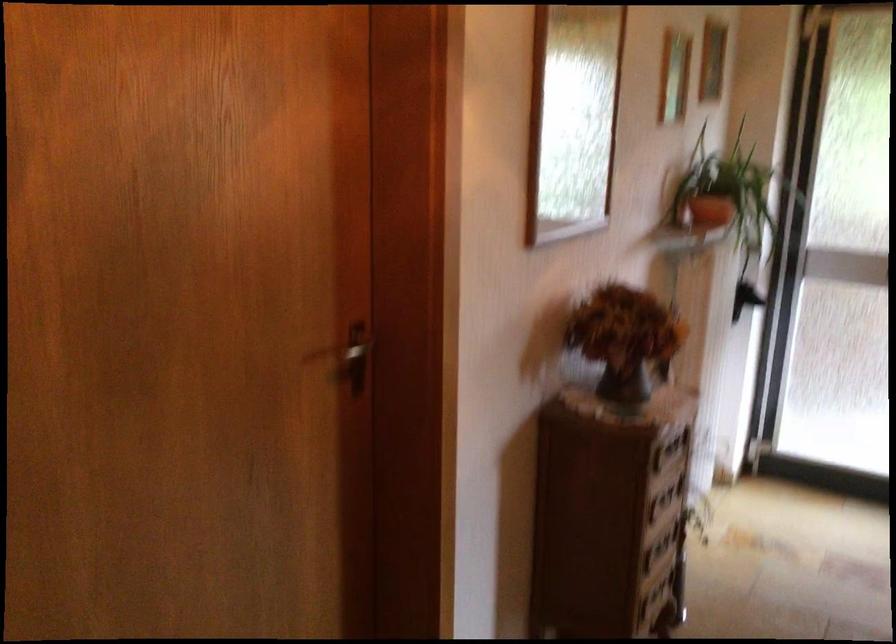
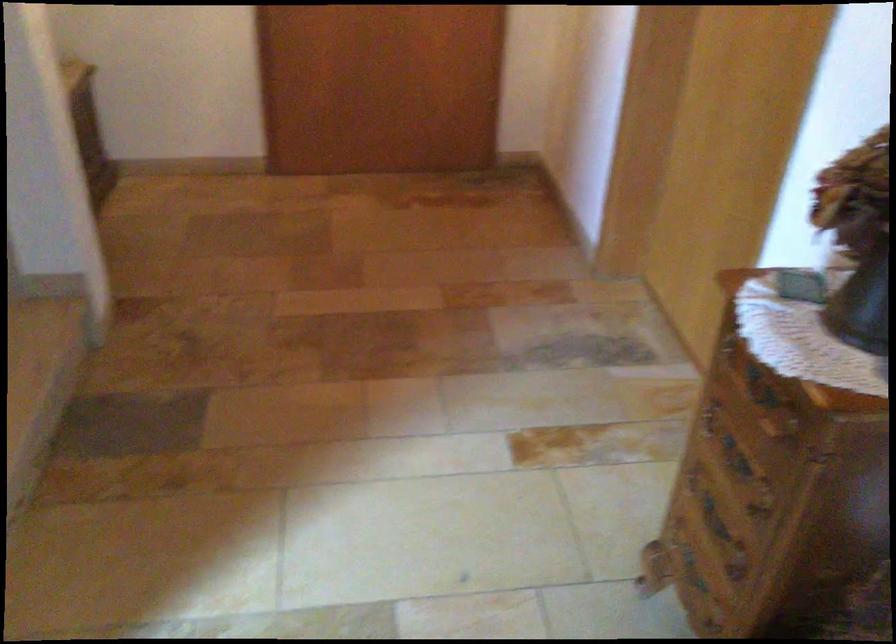
In the second image, find the point that corresponds to [642,538] in the first image.

(735, 457)